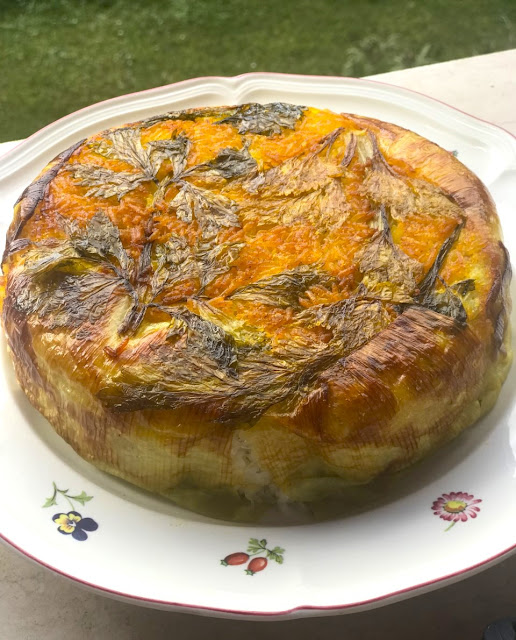
At what (x,y) coordinates should I click in order to perform the action: click on table. Please return your answer as a coordinate pair (x, y). This screenshot has width=516, height=640. Looking at the image, I should click on pos(63,612).